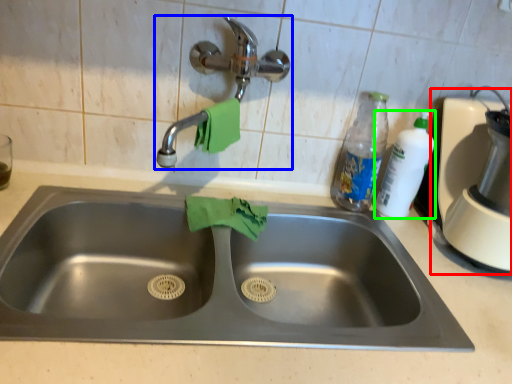
Question: Which object is the farthest from blender (highlighted by a red box)? Choose among these: tap (highlighted by a blue box) or cleaning product (highlighted by a green box).

Choices:
 (A) tap
 (B) cleaning product

Answer: (A)